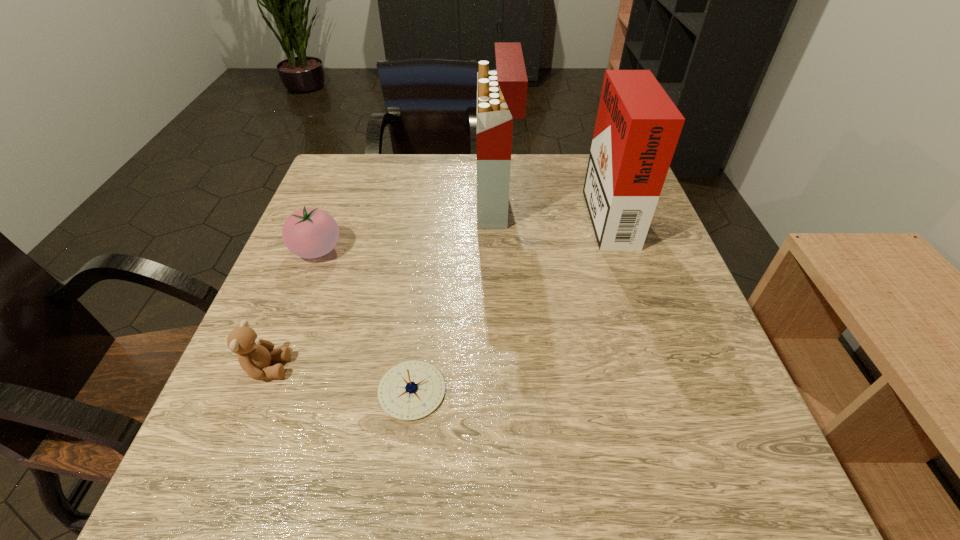
Where is `vacant space at the near edge`? vacant space at the near edge is located at coordinates click(357, 477).

In the image, there is a desktop. Where is `free space at the left edge`? This screenshot has width=960, height=540. free space at the left edge is located at coordinates (312, 206).

In the image, there is a desktop. Where is `free space at the right edge`? The image size is (960, 540). free space at the right edge is located at coordinates (640, 284).

In the image, there is a desktop. Where is `vacant space at the far left corner`? vacant space at the far left corner is located at coordinates (363, 189).

In the image, there is a desktop. Where is `vacant space at the near right corner`? vacant space at the near right corner is located at coordinates (687, 487).

Find the location of a particular element. free space that is in between the second object from right to left and the rightmost object is located at coordinates (552, 207).

At what (x,y) coordinates should I click in order to perform the action: click on free area in between the rightmost object and the teddy bear. Please return your answer as a coordinate pair (x, y). The height and width of the screenshot is (540, 960). Looking at the image, I should click on (437, 290).

Find the location of a particular element. free space between the compass and the right cigarette case is located at coordinates (510, 301).

Identify the location of unoccupied area between the rightmost object and the teddy bear. [x=437, y=290].

At what (x,y) coordinates should I click in order to perform the action: click on free space between the tomato and the teddy bear. Please return your answer as a coordinate pair (x, y). Looking at the image, I should click on (292, 309).